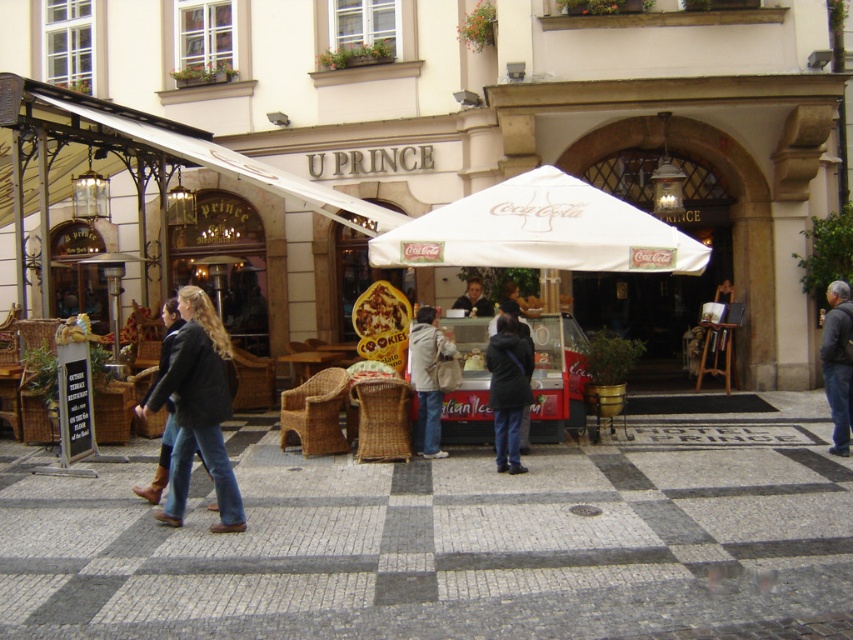
Question: Does denim jacket at lower left appear on the left side of leather jacket at center?

Choices:
 (A) no
 (B) yes

Answer: (A)

Question: Which object appears closest to the camera in this image?

Choices:
 (A) gray fabric jacket at lower right
 (B) white fabric umbrella at center

Answer: (B)

Question: Which object appears farthest from the camera in this image?

Choices:
 (A) dark brown leather jacket at center
 (B) checkerboard stone pavement at center
 (C) gray fabric jacket at lower right
 (D) leather jacket at center

Answer: (A)

Question: Can you confirm if dark blue jeans at center is positioned below leather jacket at center?

Choices:
 (A) yes
 (B) no

Answer: (B)

Question: Which of these objects is positioned farthest from the gray fabric jacket at lower right?

Choices:
 (A) dark brown leather jacket at center
 (B) checkerboard stone pavement at center
 (C) gray stone square at center
 (D) denim jacket at lower left

Answer: (D)

Question: Does gray fabric jacket at lower right have a greater width compared to dark brown leather jacket at center?

Choices:
 (A) no
 (B) yes

Answer: (B)